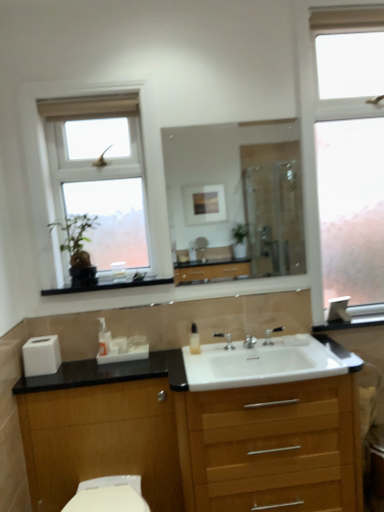
Locate an element on the screen. This screenshot has width=384, height=512. free space in front of translucent plastic soap dispenser at center, marked as the 1th soap dispenser in a right-to-left arrangement is located at coordinates click(201, 366).